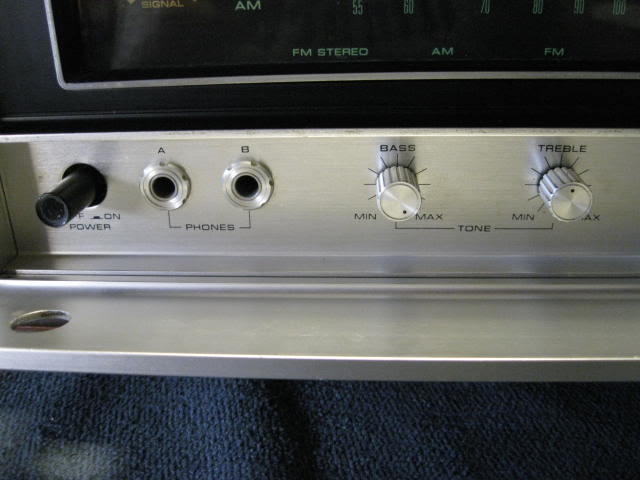
Locate an element on the screen. This screenshot has height=480, width=640. headphone jacks is located at coordinates (164, 185).